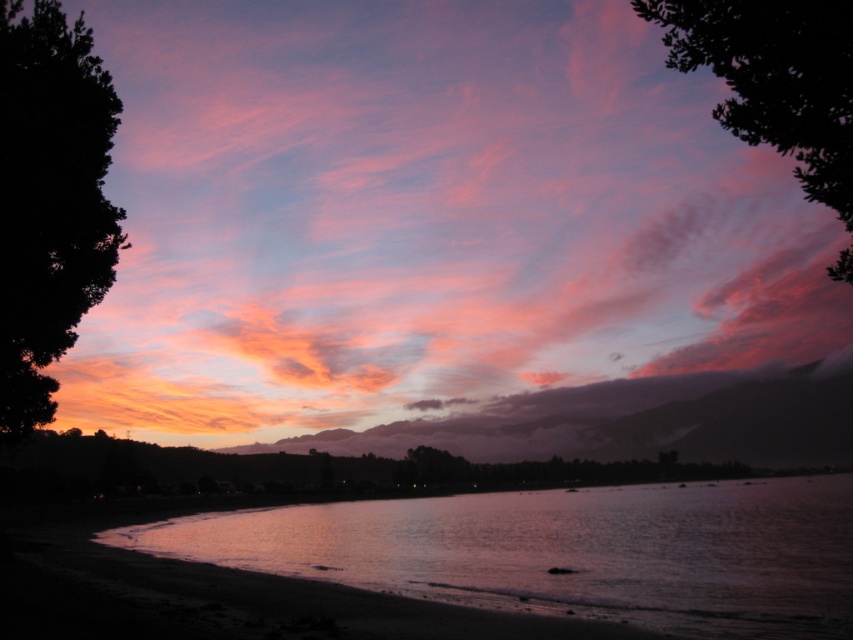
You are standing on the beach and want to take a photo of the point at coordinates (786, 520). The camera you have can focus up to 60 meters. Will the point be in focus?

The distance of point (786, 520) from the camera is 58.79 meters, which is within the camera focus range of 60 meters. Therefore, the point will be in focus.

You are standing on the beach and see the silhouette tree at left and the dark green leafy tree at upper right. Which tree appears closer to you based on their positions in the image?

The silhouette tree at left appears closer because it is positioned over the dark green leafy tree at upper right, which suggests it is in front.